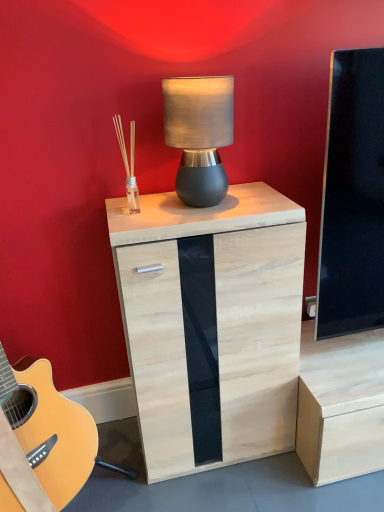
Question: Can you confirm if light wood/glass cabinet at center is wider than matte gray lamp at center?

Choices:
 (A) yes
 (B) no

Answer: (A)

Question: Does light wood/glass cabinet at center have a smaller size compared to matte gray lamp at center?

Choices:
 (A) no
 (B) yes

Answer: (A)

Question: Considering the relative positions of light wood/glass cabinet at center and matte gray lamp at center in the image provided, is light wood/glass cabinet at center to the left of matte gray lamp at center from the viewer's perspective?

Choices:
 (A) no
 (B) yes

Answer: (A)

Question: Does light wood/glass cabinet at center appear on the right side of matte gray lamp at center?

Choices:
 (A) no
 (B) yes

Answer: (B)

Question: From the image's perspective, is light wood/glass cabinet at center over matte gray lamp at center?

Choices:
 (A) no
 (B) yes

Answer: (A)

Question: Is light wood/glass cabinet at center closer to camera compared to matte gray lamp at center?

Choices:
 (A) yes
 (B) no

Answer: (B)

Question: From the image's perspective, does matte gray lamp at center appear higher than light wood/glass cabinet at center?

Choices:
 (A) no
 (B) yes

Answer: (B)

Question: Does matte gray lamp at center have a greater width compared to light wood/glass cabinet at center?

Choices:
 (A) yes
 (B) no

Answer: (B)

Question: From the image's perspective, is matte gray lamp at center beneath light wood/glass cabinet at center?

Choices:
 (A) yes
 (B) no

Answer: (B)

Question: Does matte gray lamp at center appear on the left side of light wood/glass cabinet at center?

Choices:
 (A) yes
 (B) no

Answer: (A)

Question: Can you confirm if matte gray lamp at center is thinner than light wood/glass cabinet at center?

Choices:
 (A) no
 (B) yes

Answer: (B)

Question: Does matte gray lamp at center have a larger size compared to light wood/glass cabinet at center?

Choices:
 (A) no
 (B) yes

Answer: (A)

Question: Which is correct: matte gray lamp at center is inside light wood/glass cabinet at center, or outside of it?

Choices:
 (A) outside
 (B) inside

Answer: (A)